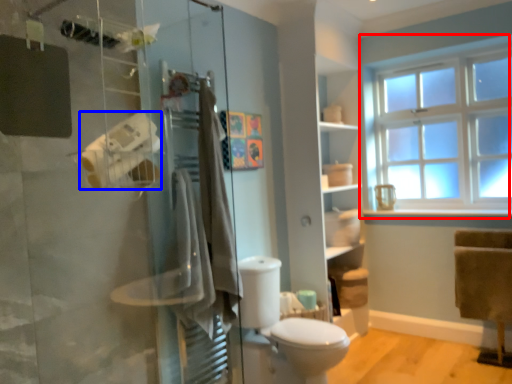
Question: Which of the following is the closest to the observer, window (highlighted by a red box) or toilet paper (highlighted by a blue box)?

Choices:
 (A) window
 (B) toilet paper

Answer: (B)